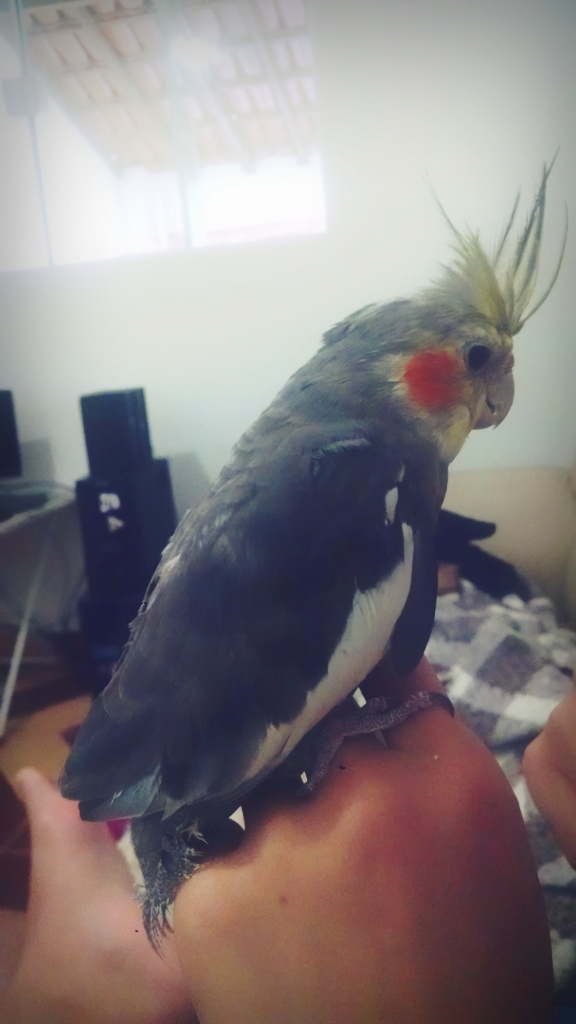
Where is `windows`? The width and height of the screenshot is (576, 1024). windows is located at coordinates pos(128,252), pos(240,216), pos(22,225).